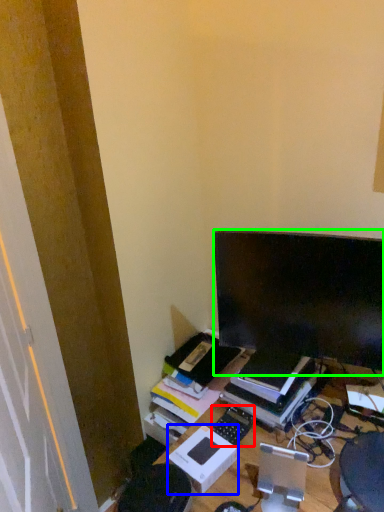
Question: Which object is positioned farthest from computer keyboard (highlighted by a red box)? Select from cardboard box (highlighted by a blue box) and computer monitor (highlighted by a green box).

Choices:
 (A) cardboard box
 (B) computer monitor

Answer: (B)